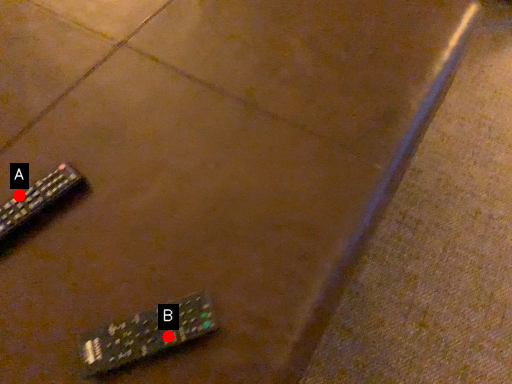
Question: Two points are circled on the image, labeled by A and B beside each circle. Which point is closer to the camera taking this photo?

Choices:
 (A) A is closer
 (B) B is closer

Answer: (B)